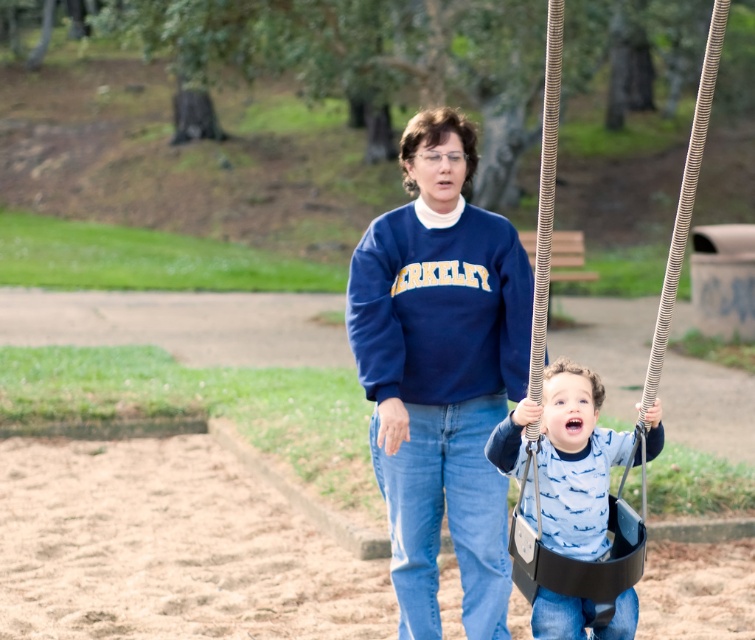
Question: Which point appears farthest from the camera in this image?

Choices:
 (A) (525, 419)
 (B) (436, 428)
 (C) (604, 582)

Answer: (B)

Question: Is navy blue sweatshirt at center to the left of matte black swing seat at center from the viewer's perspective?

Choices:
 (A) yes
 (B) no

Answer: (A)

Question: Is navy blue sweatshirt at center positioned behind matte black swing seat at center?

Choices:
 (A) yes
 (B) no

Answer: (A)

Question: Which point is farther to the camera?

Choices:
 (A) matte black swing seat at center
 (B) navy blue sweatshirt at center
 (C) black plastic swing at center

Answer: (B)

Question: Observing the image, what is the correct spatial positioning of black plastic swing at center in reference to matte black swing seat at center?

Choices:
 (A) below
 (B) above

Answer: (B)

Question: Estimate the real-world distances between objects in this image. Which object is closer to the matte black swing seat at center?

Choices:
 (A) black plastic swing at center
 (B) navy blue sweatshirt at center

Answer: (A)